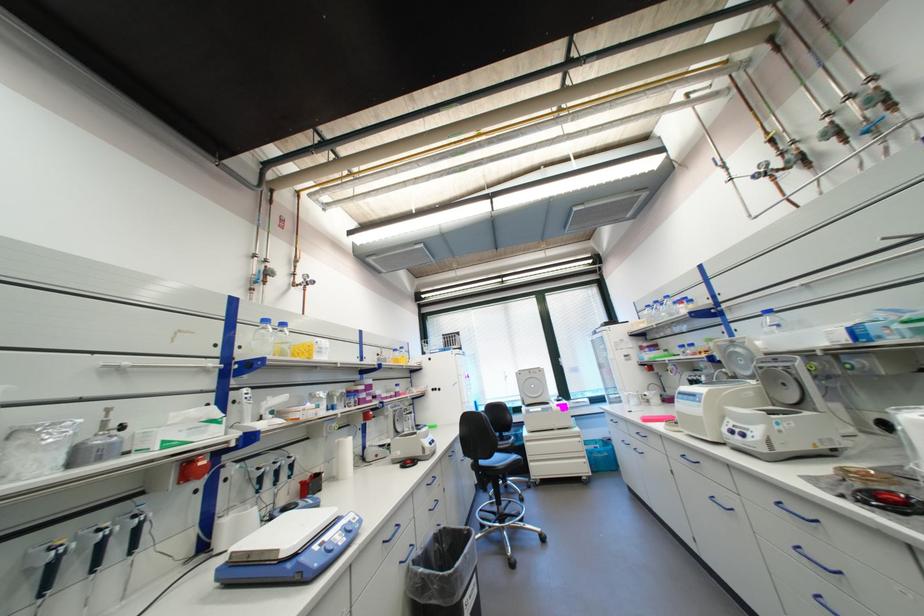
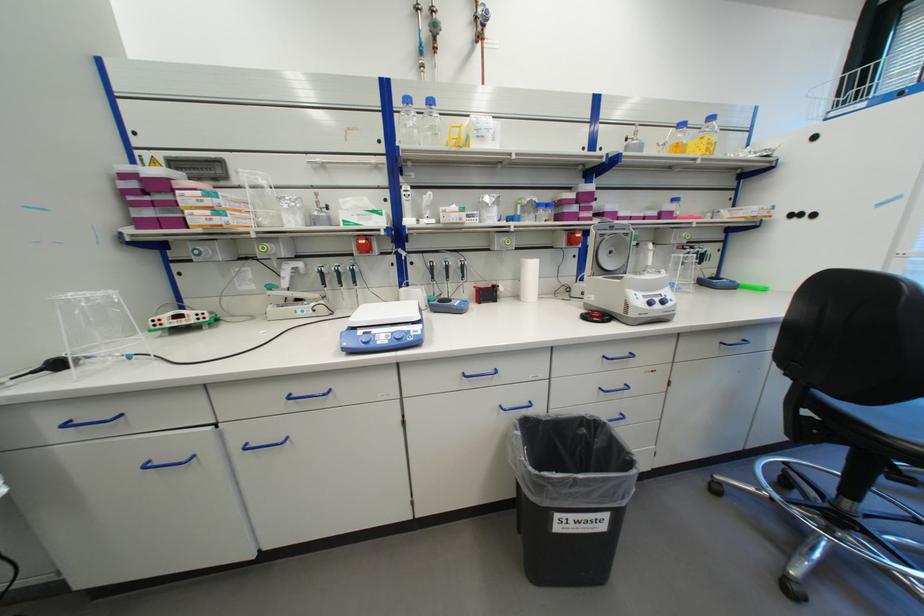
Where in the second image is the point corresponding to [195,476] from the first image?

(373, 249)